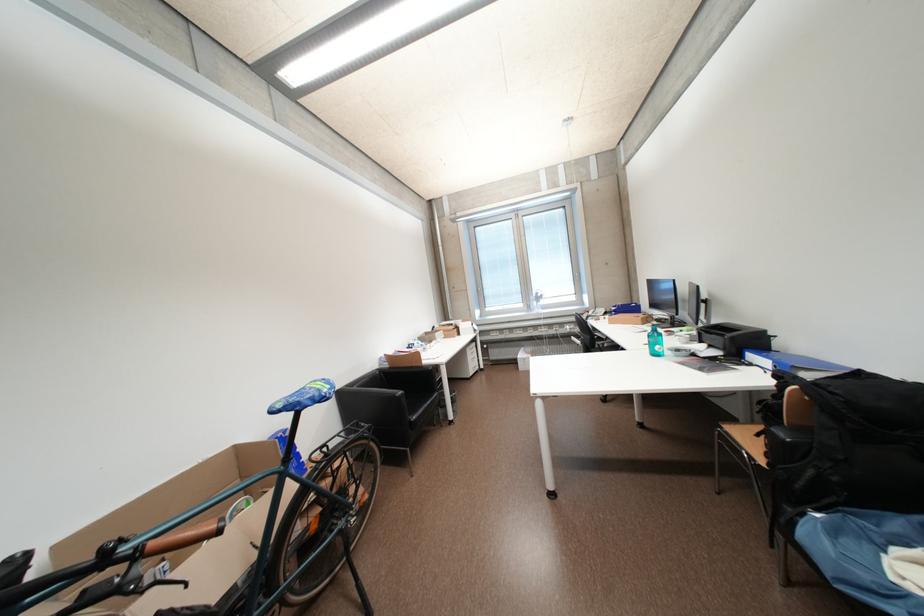
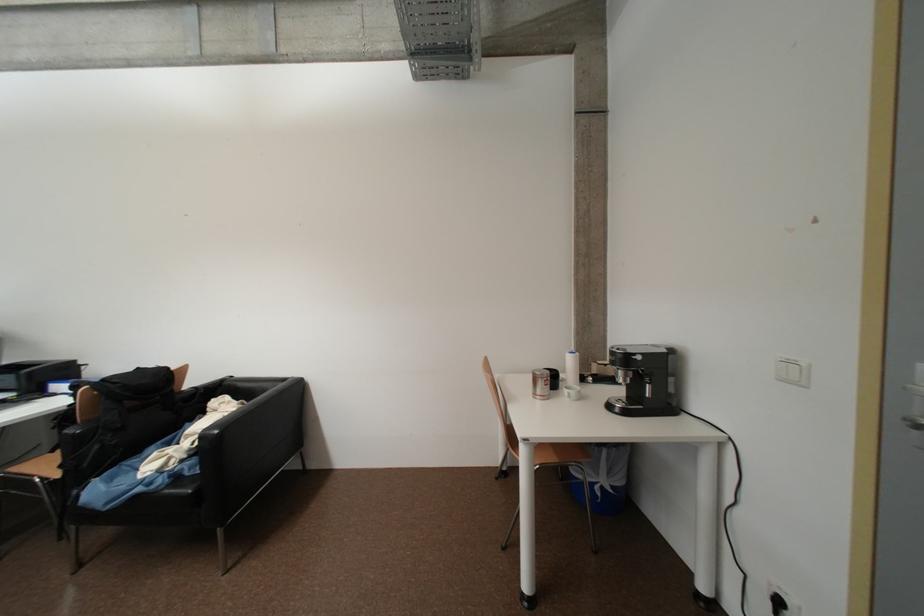
The point at [872,578] is marked in the first image. Where is the corresponding point in the second image?

(130, 488)